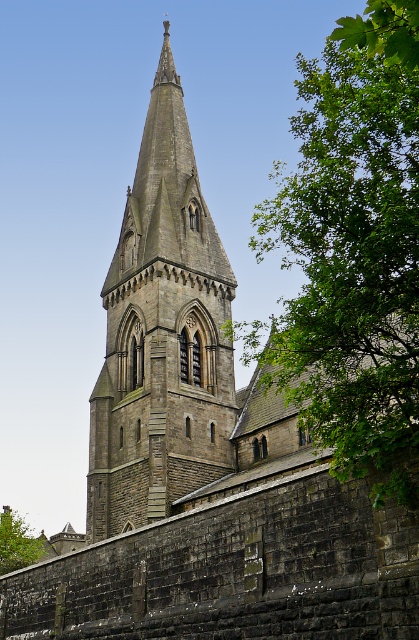
You are an architect planning to add a new structure to the church grounds. You observe the green leafy tree at upper right and the gray stone tower at center. Which object occupies a larger horizontal space in the image?

The green leafy tree at upper right might be wider than the gray stone tower at center, so it could occupy a larger horizontal space in the image.

You are standing at the base of the gray stone tower at center and want to see the green leafy tree at lower left. In which direction should you look relative to your current position?

The gray stone tower at center is located above the green leafy tree at lower left, so you should look downward to see the green leafy tree at lower left from your current position.